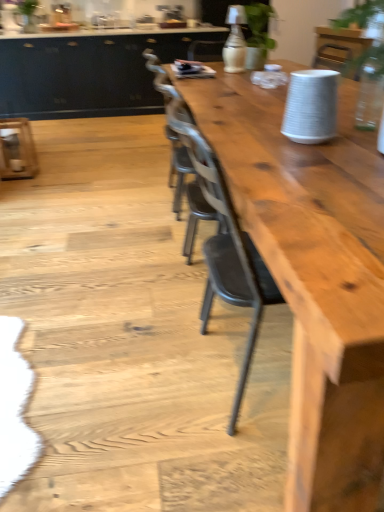
Question: Considering the positions of matte black cabinetry at upper left and natural wood table at center in the image, is matte black cabinetry at upper left wider or thinner than natural wood table at center?

Choices:
 (A) wide
 (B) thin

Answer: (B)

Question: Is matte black cabinetry at upper left spatially inside natural wood table at center, or outside of it?

Choices:
 (A) outside
 (B) inside

Answer: (A)

Question: In the image, is matte black cabinetry at upper left positioned in front of or behind natural wood table at center?

Choices:
 (A) behind
 (B) front

Answer: (A)

Question: From their relative heights in the image, would you say natural wood table at center is taller or shorter than matte black cabinetry at upper left?

Choices:
 (A) short
 (B) tall

Answer: (A)

Question: Is natural wood table at center bigger or smaller than matte black cabinetry at upper left?

Choices:
 (A) big
 (B) small

Answer: (B)

Question: Would you say natural wood table at center is to the left or to the right of matte black cabinetry at upper left in the picture?

Choices:
 (A) right
 (B) left

Answer: (A)

Question: From the image's perspective, is natural wood table at center above or below matte black cabinetry at upper left?

Choices:
 (A) above
 (B) below

Answer: (B)